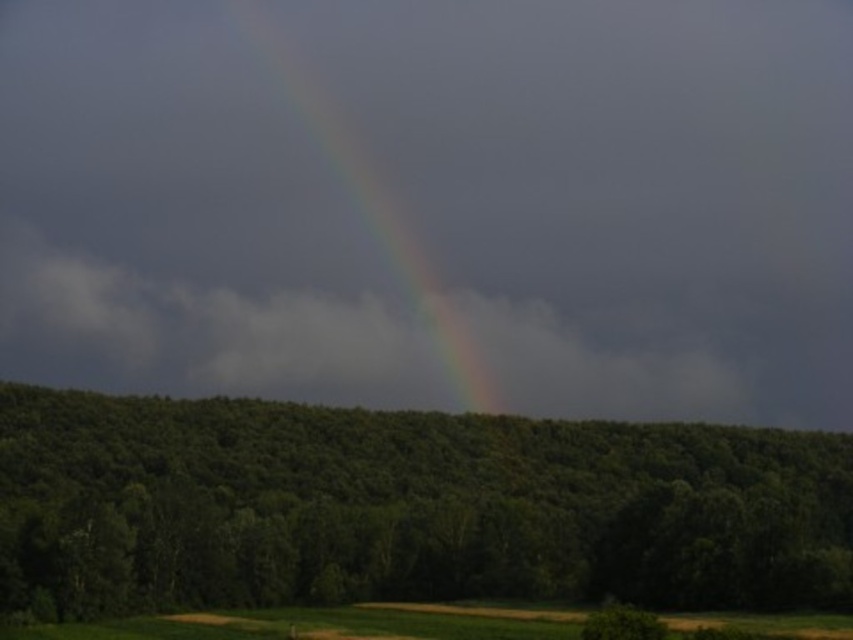
Can you confirm if green grassy field at lower center is shorter than rainbow at center?

Yes, green grassy field at lower center is shorter than rainbow at center.

Does point (477, 604) lie behind point (289, 61)?

That is False.

Where is `green grassy field at lower center`? The image size is (853, 640). green grassy field at lower center is located at coordinates click(x=325, y=624).

Does green leafy tree at center appear under rainbow at center?

Yes.

Which is below, green leafy tree at center or rainbow at center?

green leafy tree at center is below.

Describe the element at coordinates (405, 508) in the screenshot. This screenshot has height=640, width=853. I see `green leafy tree at center` at that location.

Find the location of a particular element. green leafy tree at center is located at coordinates (405, 508).

Does point (502, 560) lie in front of point (842, 634)?

No, (502, 560) is further to viewer.

Between green leafy tree at center and green grassy field at lower center, which one is positioned higher?

green leafy tree at center

Where is `green leafy tree at center`? The height and width of the screenshot is (640, 853). green leafy tree at center is located at coordinates (405, 508).

Find the location of a particular element. The image size is (853, 640). green leafy tree at center is located at coordinates (405, 508).